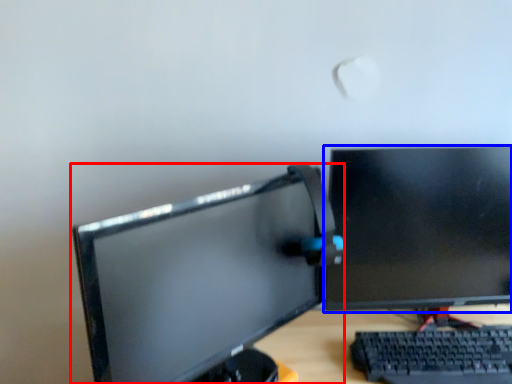
Question: Which object appears closest to the camera in this image, computer monitor (highlighted by a red box) or computer monitor (highlighted by a blue box)?

Choices:
 (A) computer monitor
 (B) computer monitor

Answer: (A)